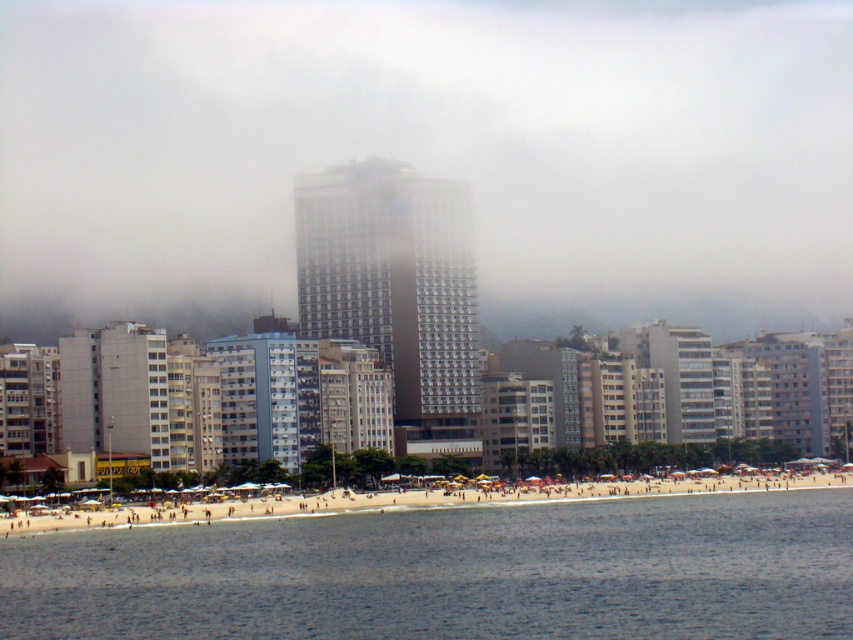
You are a photographer trying to capture the entire scene from the beach to the distant highrise. Considering the transparent fog at center and the beige sand beach at lower center, which object might block your view of the highrise building?

The transparent fog at center has a greater height compared to the beige sand beach at lower center, so it might block your view of the highrise building.